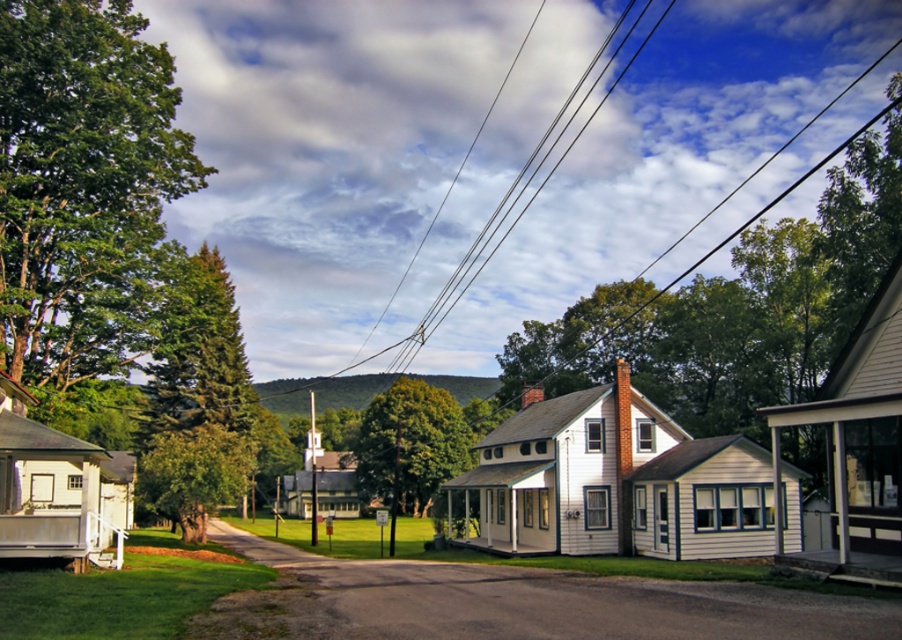
Question: Can you confirm if green leafy tree at left is bigger than smooth asphalt driveway at center?

Choices:
 (A) no
 (B) yes

Answer: (A)

Question: Where is green leafy tree at left located in relation to black wire at upper center in the image?

Choices:
 (A) above
 (B) below

Answer: (B)

Question: Which of these objects is positioned closest to the black wire at upper center?

Choices:
 (A) green leafy tree at center
 (B) smooth asphalt driveway at center

Answer: (A)

Question: Does black wire at upper center appear on the right side of green leafy tree at center?

Choices:
 (A) no
 (B) yes

Answer: (B)

Question: Which of these objects is positioned farthest from the black wire at upper center?

Choices:
 (A) green leafy tree at center
 (B) smooth asphalt driveway at center

Answer: (B)

Question: Which is nearer to the black wire at upper center?

Choices:
 (A) green leafy tree at left
 (B) green leafy tree at center
 (C) smooth asphalt driveway at center

Answer: (B)